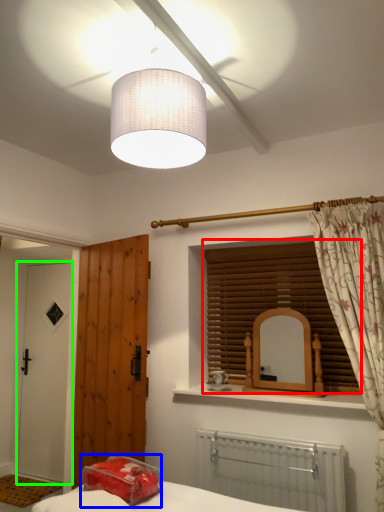
Question: Based on their relative distances, which object is farther from window blind (highlighted by a red box)? Choose from pillow (highlighted by a blue box) and door (highlighted by a green box).

Choices:
 (A) pillow
 (B) door

Answer: (B)